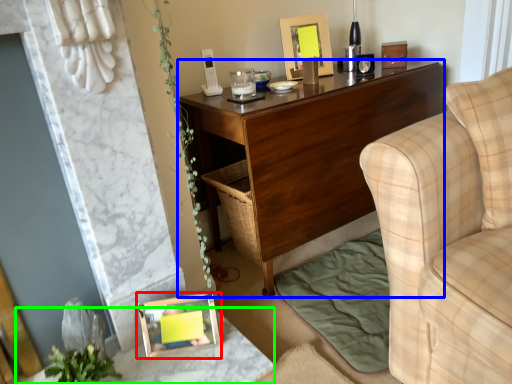
Question: Based on their relative distances, which object is farther from picture frame (highlighted by a red box)? Choose from desk (highlighted by a blue box) and table (highlighted by a green box).

Choices:
 (A) desk
 (B) table

Answer: (A)